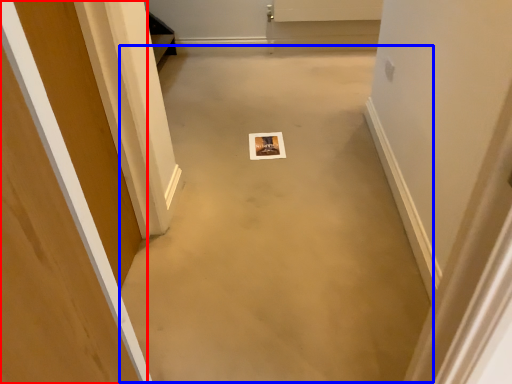
Question: Which point is further to the camera, door (highlighted by a red box) or concrete (highlighted by a blue box)?

Choices:
 (A) door
 (B) concrete

Answer: (B)